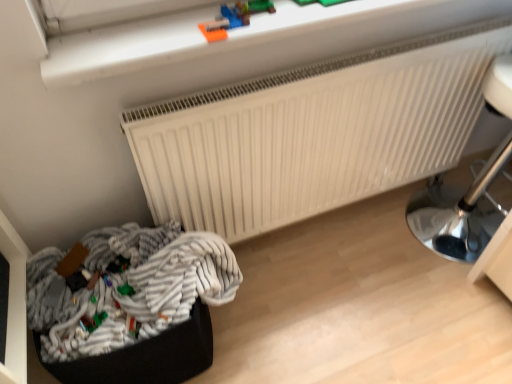
This screenshot has height=384, width=512. In order to click on vacant area on top of white matte radiator at upper center (from a real-world perspective) in this screenshot , I will do 293,81.